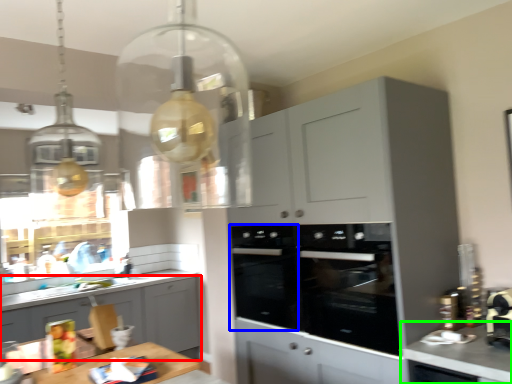
Question: Estimate the real-world distances between objects in this image. Which object is closer to cabinetry (highlighted by a red box), oven (highlighted by a blue box) or countertop (highlighted by a green box)?

Choices:
 (A) oven
 (B) countertop

Answer: (A)